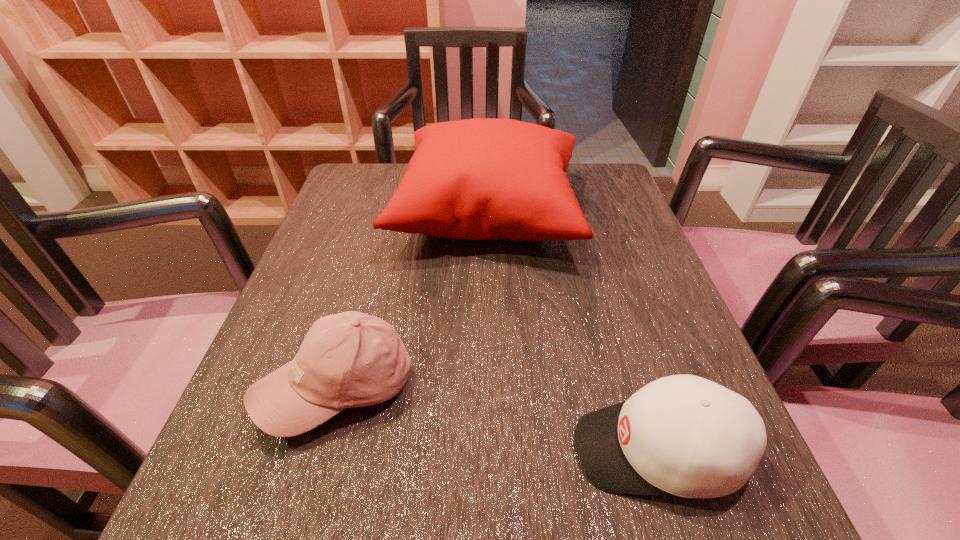
Identify the location of the farthest object. (475, 179).

The width and height of the screenshot is (960, 540). I want to click on cushion, so click(x=475, y=179).

This screenshot has width=960, height=540. In order to click on the left baseball cap in this screenshot , I will do `click(351, 359)`.

Find the location of a particular element. the right baseball cap is located at coordinates (682, 435).

Find the location of a particular element. The height and width of the screenshot is (540, 960). vacant region located 0.320m on the front of the tallest object is located at coordinates (493, 416).

Locate an element on the screen. This screenshot has width=960, height=540. free location located on the front-facing side of the left baseball cap is located at coordinates pyautogui.click(x=297, y=535).

Image resolution: width=960 pixels, height=540 pixels. Identify the location of vacant space located 0.130m on the front-facing side of the right baseball cap. (483, 450).

Where is `vacant space located on the front-facing side of the right baseball cap`? vacant space located on the front-facing side of the right baseball cap is located at coordinates (497, 450).

Identify the location of free point located on the front-facing side of the right baseball cap. Image resolution: width=960 pixels, height=540 pixels. (483, 450).

Locate an element on the screen. The image size is (960, 540). object that is at the far edge is located at coordinates click(x=475, y=179).